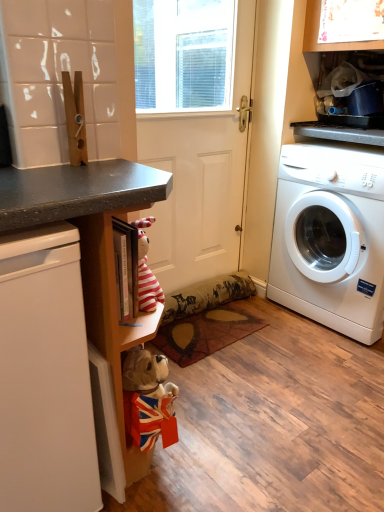
Question: From the image's perspective, relative to white matte dishwasher at left, is white plastic washing machine at right above or below?

Choices:
 (A) above
 (B) below

Answer: (A)

Question: Looking at the image, does white plastic washing machine at right seem bigger or smaller compared to white matte dishwasher at left?

Choices:
 (A) small
 (B) big

Answer: (B)

Question: Estimate the real-world distances between objects in this image. Which object is closer to the white matte dishwasher at left?

Choices:
 (A) matte black counter at lower left
 (B) patterned fabric mat at center
 (C) white matte screen door at center
 (D) white plastic washing machine at right

Answer: (A)

Question: Estimate the real-world distances between objects in this image. Which object is closer to the patterned fabric mat at center?

Choices:
 (A) matte black counter at lower left
 (B) white matte screen door at center
 (C) white matte dishwasher at left
 (D) white plastic washing machine at right

Answer: (B)